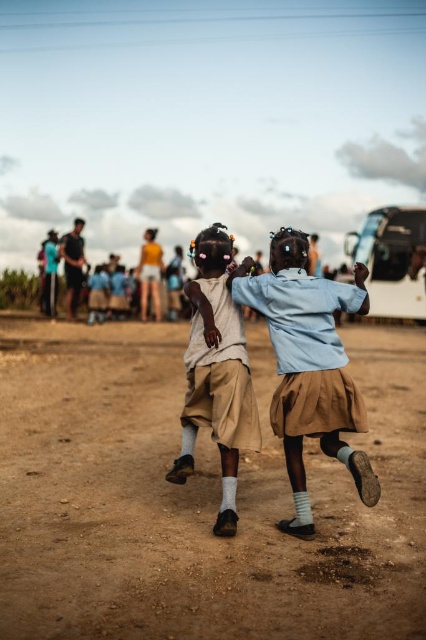
Is light blue fabric shirt at center to the right of dark blue shirt at center from the viewer's perspective?

Indeed, light blue fabric shirt at center is positioned on the right side of dark blue shirt at center.

Who is more distant from viewer, (290,234) or (74,221)?

The point (74,221) is more distant.

The width and height of the screenshot is (426, 640). Identify the location of light blue fabric shirt at center. (308, 365).

Between point (206, 280) and point (83, 243), which one is positioned in front?

Point (206, 280) is more forward.

Between light brown cotton shorts at center and dark blue shirt at center, which one appears on the left side from the viewer's perspective?

Positioned to the left is dark blue shirt at center.

Find the location of a particular element. light brown cotton shorts at center is located at coordinates (216, 372).

Does brown sandy ground at center have a greater height compared to light brown cotton shorts at center?

No, brown sandy ground at center is not taller than light brown cotton shorts at center.

Is the position of brown sandy ground at center less distant than that of light brown cotton shorts at center?

Yes, brown sandy ground at center is closer to the viewer.

Locate an element on the screen. This screenshot has height=640, width=426. brown sandy ground at center is located at coordinates (195, 499).